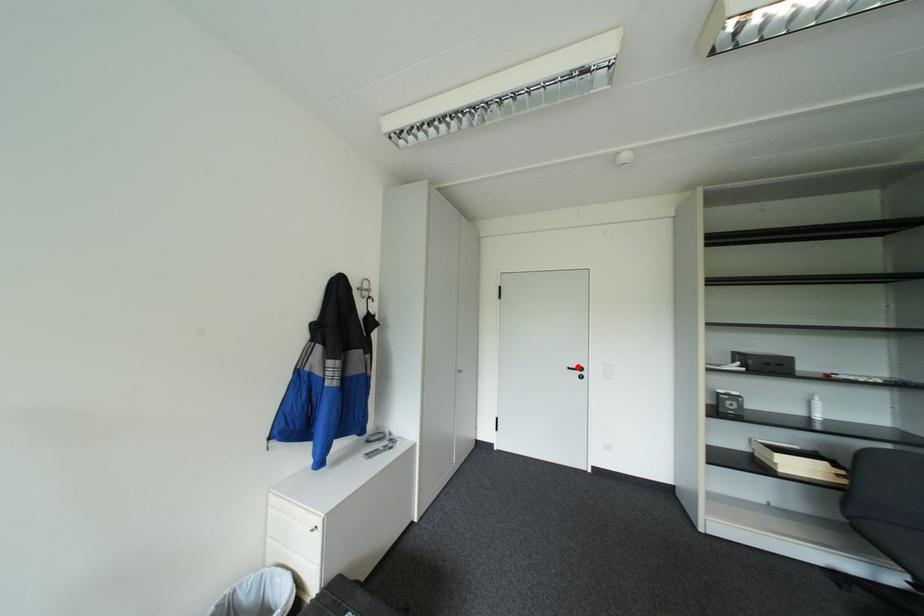
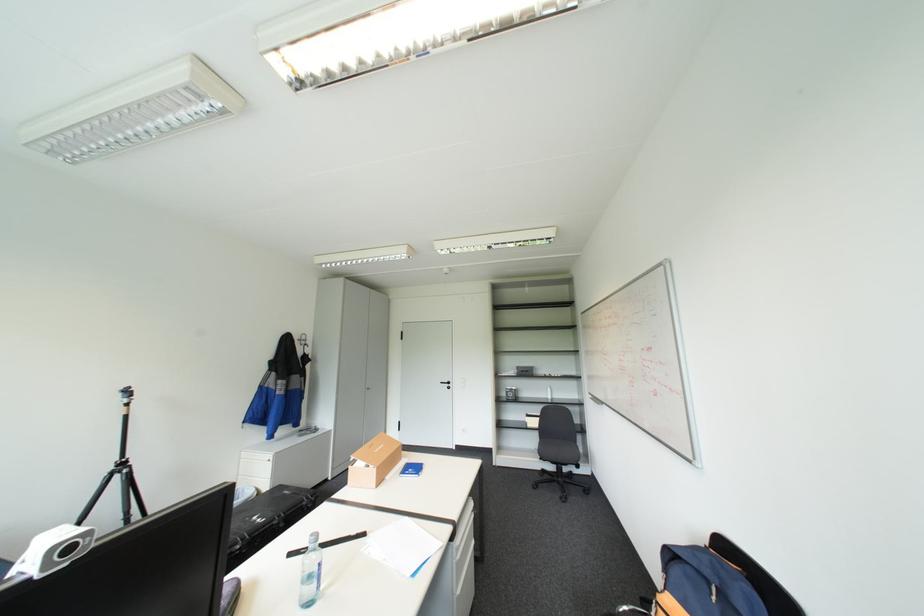
The point at the highlighted location is marked in the first image. Where is the corresponding point in the second image?

(450, 381)